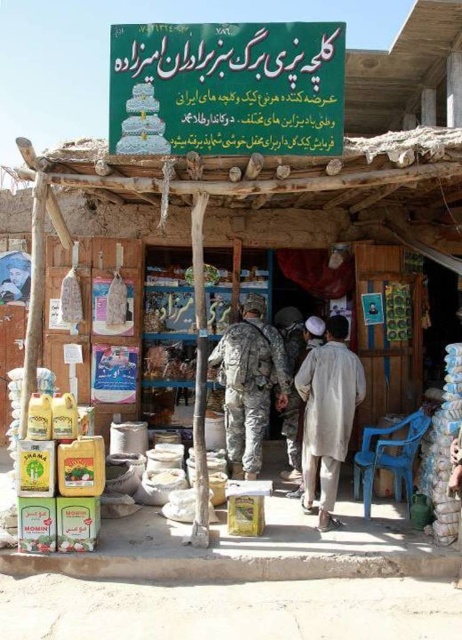
Question: Which is nearer to the camouflage fabric uniform at center?

Choices:
 (A) light beige fabric at center
 (B) matte plastic signboard at upper center

Answer: (A)

Question: Does matte plastic signboard at upper center appear on the right side of camouflage fabric uniform at center?

Choices:
 (A) yes
 (B) no

Answer: (B)

Question: Which object is closer to the camera taking this photo?

Choices:
 (A) camouflage fabric uniform at center
 (B) matte plastic signboard at upper center
 (C) light beige fabric at center

Answer: (B)

Question: Can you confirm if light beige fabric at center is positioned below camouflage fabric uniform at center?

Choices:
 (A) yes
 (B) no

Answer: (A)

Question: Which point is closer to the camera taking this photo?

Choices:
 (A) (311, 380)
 (B) (232, 36)

Answer: (B)

Question: Observing the image, what is the correct spatial positioning of matte plastic signboard at upper center in reference to light beige fabric at center?

Choices:
 (A) right
 (B) left

Answer: (B)